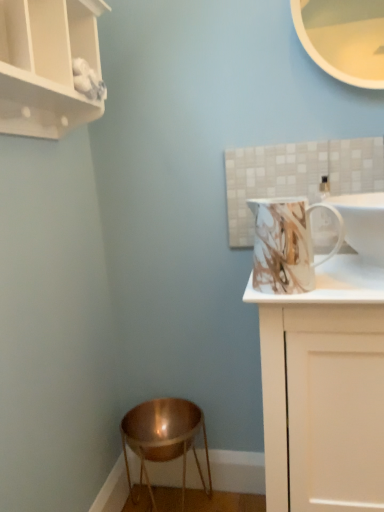
Identify the location of marble-patterned ceramic mug at upper right. The image size is (384, 512). (286, 244).

Describe the element at coordinates (46, 65) in the screenshot. I see `white matte cupboard at upper left` at that location.

At what (x,y) coordinates should I click in order to perform the action: click on copper metallic stool at lower left. Please return your answer as a coordinate pair (x, y). Image resolution: width=384 pixels, height=512 pixels. Looking at the image, I should click on (163, 438).

What do you see at coordinates (325, 389) in the screenshot?
I see `white glossy cabinet at right` at bounding box center [325, 389].

In order to face white glossy sink at upper right, should I rotate leftwards or rightwards?

Rotate right and turn 21.705 degrees.

The height and width of the screenshot is (512, 384). I want to click on marble-patterned ceramic mug at upper right, so click(x=286, y=244).

Considering the relative sizes of copper metallic stool at lower left and white glossy cabinet at right in the image provided, is copper metallic stool at lower left bigger than white glossy cabinet at right?

Incorrect, copper metallic stool at lower left is not larger than white glossy cabinet at right.

Between copper metallic stool at lower left and white glossy cabinet at right, which one appears on the right side from the viewer's perspective?

white glossy cabinet at right is more to the right.

At what (x,y) coordinates should I click in order to perform the action: click on stool behind the white glossy cabinet at right. Please return your answer as a coordinate pair (x, y). The width and height of the screenshot is (384, 512). Looking at the image, I should click on (163, 438).

The width and height of the screenshot is (384, 512). In order to click on sink behind the white glossy cabinet at right in this screenshot , I will do `click(363, 223)`.

Between white glossy sink at upper right and white glossy cabinet at right, which one is positioned behind?

white glossy sink at upper right is behind.

From a real-world perspective, is white glossy sink at upper right physically below white glossy cabinet at right?

No, from a real-world perspective, white glossy sink at upper right is not under white glossy cabinet at right.

Can you confirm if white glossy sink at upper right is bigger than white glossy cabinet at right?

Incorrect, white glossy sink at upper right is not larger than white glossy cabinet at right.

Is marble-patterned ceramic mug at upper right positioned beyond the bounds of white matte cupboard at upper left?

marble-patterned ceramic mug at upper right lies outside white matte cupboard at upper left's area.

How different are the orientations of marble-patterned ceramic mug at upper right and white matte cupboard at upper left in degrees?

89.8 degrees.

From the picture: Is marble-patterned ceramic mug at upper right positioned far away from white matte cupboard at upper left?

marble-patterned ceramic mug at upper right is actually quite close to white matte cupboard at upper left.

Which of these two, marble-patterned ceramic mug at upper right or white matte cupboard at upper left, stands taller?

Standing taller between the two is white matte cupboard at upper left.

Where is `cabinetry below the marble-patterned ceramic mug at upper right (from a real-world perspective)`? cabinetry below the marble-patterned ceramic mug at upper right (from a real-world perspective) is located at coordinates (325, 389).

Is white glossy cabinet at right facing towards marble-patterned ceramic mug at upper right?

No, white glossy cabinet at right is not facing towards marble-patterned ceramic mug at upper right.

From a real-world perspective, is white glossy cabinet at right above or below marble-patterned ceramic mug at upper right?

white glossy cabinet at right is situated lower than marble-patterned ceramic mug at upper right in the real world.

Is point (290, 353) closer to viewer compared to point (303, 286)?

No, (290, 353) is further to viewer.

Is white matte cupboard at upper left positioned before marble-patterned ceramic mug at upper right?

Yes, it is.

From a real-world perspective, is white matte cupboard at upper left above or below marble-patterned ceramic mug at upper right?

white matte cupboard at upper left is situated higher than marble-patterned ceramic mug at upper right in the real world.

Is white matte cupboard at upper left taller than marble-patterned ceramic mug at upper right?

Correct, white matte cupboard at upper left is much taller as marble-patterned ceramic mug at upper right.

From a real-world perspective, between white matte cupboard at upper left and white glossy sink at upper right, who is vertically lower?

From a 3D spatial view, white glossy sink at upper right is below.

Between white matte cupboard at upper left and white glossy sink at upper right, which one has smaller width?

Thinner between the two is white matte cupboard at upper left.

Is white matte cupboard at upper left placed right next to white glossy sink at upper right?

No.

From the image's perspective, is white matte cupboard at upper left on white glossy sink at upper right?

Correct, white matte cupboard at upper left appears higher than white glossy sink at upper right in the image.

Is copper metallic stool at lower left positioned behind marble-patterned ceramic mug at upper right?

Yes, copper metallic stool at lower left is further from the viewer.

Between copper metallic stool at lower left and marble-patterned ceramic mug at upper right, which one has larger width?

Wider between the two is copper metallic stool at lower left.

Looking at this image, from a real-world perspective, is copper metallic stool at lower left on top of marble-patterned ceramic mug at upper right?

Incorrect, from a real-world perspective, copper metallic stool at lower left is lower than marble-patterned ceramic mug at upper right.

Where is `mug that appears above the copper metallic stool at lower left (from a real-world perspective)`? Image resolution: width=384 pixels, height=512 pixels. mug that appears above the copper metallic stool at lower left (from a real-world perspective) is located at coordinates coord(286,244).

The height and width of the screenshot is (512, 384). I want to click on stool behind the white glossy cabinet at right, so click(x=163, y=438).

You are a GUI agent. You are given a task and a screenshot of the screen. Output one action in this format:
    pyautogui.click(x=<x>, y=<y>)
    Task: Click on the cabinetry below the white glossy sink at upper right (from a real-world perspective)
    
    Given the screenshot: What is the action you would take?
    pyautogui.click(x=325, y=389)

Looking at this image, from the image, which object appears to be farther from copper metallic stool at lower left, white glossy cabinet at right or white matte cupboard at upper left?

The object further to copper metallic stool at lower left is white matte cupboard at upper left.

Which object lies nearer to the anchor point white glossy cabinet at right, marble-patterned ceramic mug at upper right or white matte cupboard at upper left?

Among the two, marble-patterned ceramic mug at upper right is located nearer to white glossy cabinet at right.

Looking at the image, which one is located further to copper metallic stool at lower left, white glossy sink at upper right or white matte cupboard at upper left?

white matte cupboard at upper left.

Looking at the image, which one is located further to white glossy sink at upper right, marble-patterned ceramic mug at upper right or copper metallic stool at lower left?

copper metallic stool at lower left lies further to white glossy sink at upper right than the other object.

Based on their spatial positions, is white glossy sink at upper right or white matte cupboard at upper left further from marble-patterned ceramic mug at upper right?

Among the two, white matte cupboard at upper left is located further to marble-patterned ceramic mug at upper right.

Based on their spatial positions, is white glossy cabinet at right or copper metallic stool at lower left closer to white glossy sink at upper right?

white glossy cabinet at right is positioned closer to the anchor white glossy sink at upper right.

Estimate the real-world distances between objects in this image. Which object is further from white glossy sink at upper right, copper metallic stool at lower left or white matte cupboard at upper left?

copper metallic stool at lower left is positioned further to the anchor white glossy sink at upper right.

Based on the photo, when comparing their distances from white glossy cabinet at right, does copper metallic stool at lower left or white matte cupboard at upper left seem closer?

Among the two, copper metallic stool at lower left is located nearer to white glossy cabinet at right.

At what (x,y) coordinates should I click in order to perform the action: click on sink that lies between white matte cupboard at upper left and white glossy cabinet at right from top to bottom. Please return your answer as a coordinate pair (x, y). Looking at the image, I should click on (363, 223).

This screenshot has height=512, width=384. I want to click on cabinetry between marble-patterned ceramic mug at upper right and copper metallic stool at lower left from top to bottom, so click(325, 389).

Locate an element on the screen. This screenshot has width=384, height=512. mug between white glossy sink at upper right and copper metallic stool at lower left in the up-down direction is located at coordinates (x=286, y=244).

Find the location of a particular element. The image size is (384, 512). cabinetry between white matte cupboard at upper left and copper metallic stool at lower left vertically is located at coordinates (325, 389).